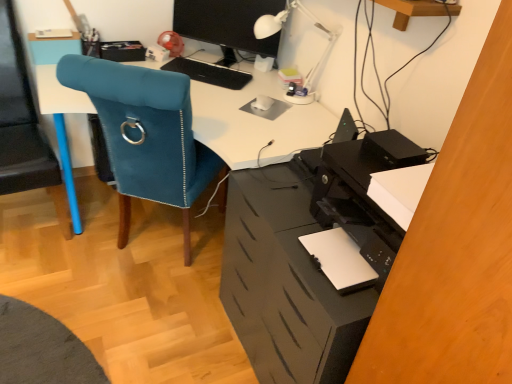
The image size is (512, 384). In order to click on free space in front of velvet blue chair at left in this screenshot , I will do `click(119, 338)`.